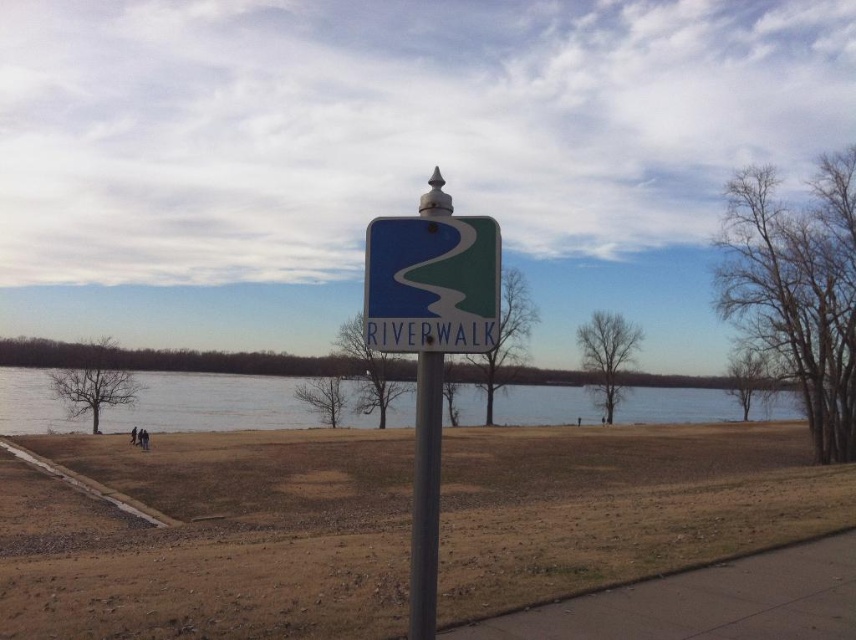
Is blue water at center taller than blue glossy sign at center?

Indeed, blue water at center has a greater height compared to blue glossy sign at center.

Which of these two, blue water at center or blue glossy sign at center, stands taller?

blue water at center is taller.

Which is in front, point (116, 420) or point (485, 234)?

Point (485, 234) is in front.

You are a GUI agent. You are given a task and a screenshot of the screen. Output one action in this format:
    pyautogui.click(x=<x>, y=<y>)
    Task: Click on the blue water at center
    
    Given the screenshot: What is the action you would take?
    pyautogui.click(x=211, y=403)

Is point (473, 348) behind point (429, 464)?

Yes, point (473, 348) is behind point (429, 464).

Based on the photo, which is below, blue glossy sign at center or metallic pole at center?

Positioned lower is metallic pole at center.

Who is more distant from viewer, (402, 260) or (415, 532)?

Positioned behind is point (402, 260).

Find the location of a particular element. This screenshot has height=640, width=856. blue glossy sign at center is located at coordinates (431, 284).

Based on the photo, does gray asphalt pavement at lower right appear under metallic pole at center?

Indeed, gray asphalt pavement at lower right is positioned under metallic pole at center.

Does gray asphalt pavement at lower right have a greater height compared to metallic pole at center?

In fact, gray asphalt pavement at lower right may be shorter than metallic pole at center.

Where is `gray asphalt pavement at lower right`? This screenshot has height=640, width=856. gray asphalt pavement at lower right is located at coordinates (704, 600).